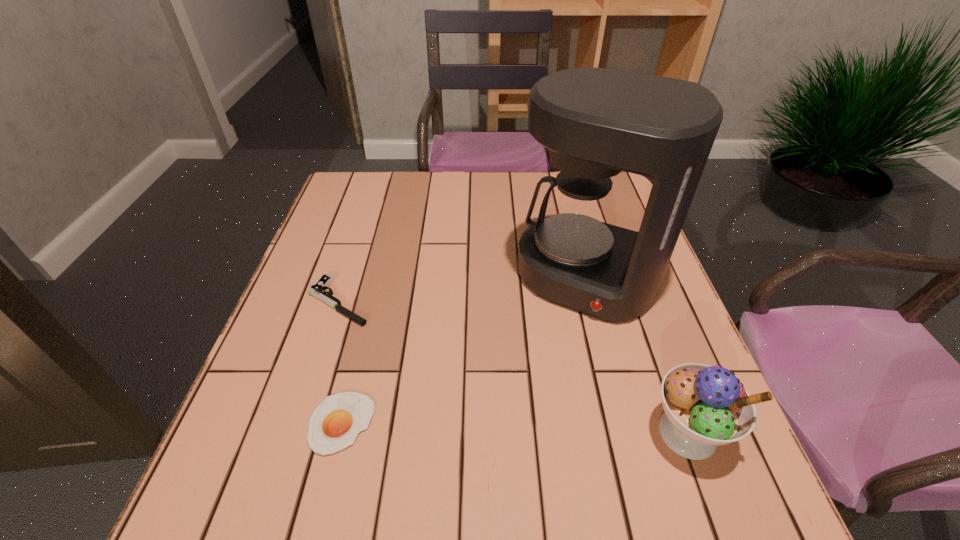
The width and height of the screenshot is (960, 540). I want to click on the shortest object, so click(335, 423).

Find the location of a particular element. Image resolution: width=960 pixels, height=540 pixels. the third shortest object is located at coordinates (705, 406).

Where is `the second shortest object`? the second shortest object is located at coordinates (319, 290).

Where is `coffee maker`? The width and height of the screenshot is (960, 540). coffee maker is located at coordinates (595, 122).

The height and width of the screenshot is (540, 960). Find the location of `vacant space positioned 0.170m on the back of the egg yolk`. vacant space positioned 0.170m on the back of the egg yolk is located at coordinates (365, 325).

I want to click on vacant space located on the left of the icecream, so click(478, 433).

Where is `vacant area situated 0.260m on the front-facing side of the pistol`? The image size is (960, 540). vacant area situated 0.260m on the front-facing side of the pistol is located at coordinates (456, 370).

I want to click on vacant space situated 0.260m on the front-facing side of the pistol, so click(x=456, y=370).

At what (x,y) coordinates should I click in order to perform the action: click on free space located 0.290m on the front-facing side of the pistol. Please return your answer as a coordinate pair (x, y). Looking at the image, I should click on pos(468,377).

The width and height of the screenshot is (960, 540). In order to click on vacant space located on the front-facing side of the tallest object in this screenshot , I will do `click(507, 428)`.